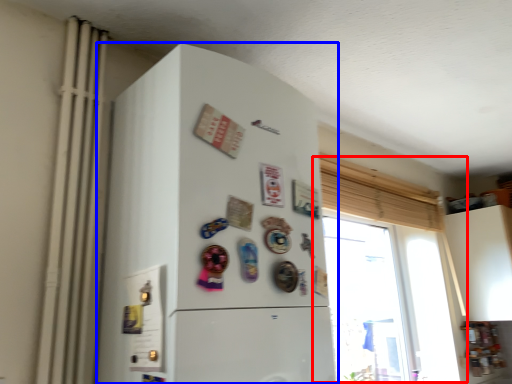
Question: Which point is further to the camera, window (highlighted by a red box) or refrigerator (highlighted by a blue box)?

Choices:
 (A) window
 (B) refrigerator

Answer: (A)